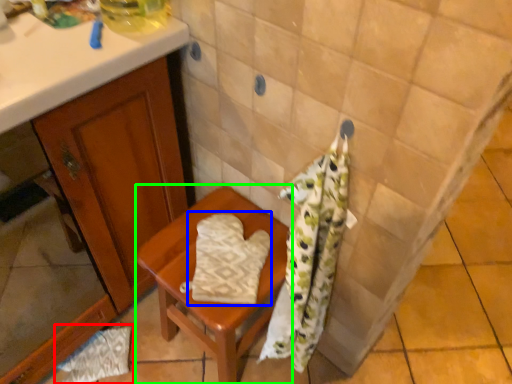
Question: Which object is positioned farthest from material (highlighted by a red box)? Select from beach towel (highlighted by a blue box) and furniture (highlighted by a green box).

Choices:
 (A) beach towel
 (B) furniture

Answer: (A)